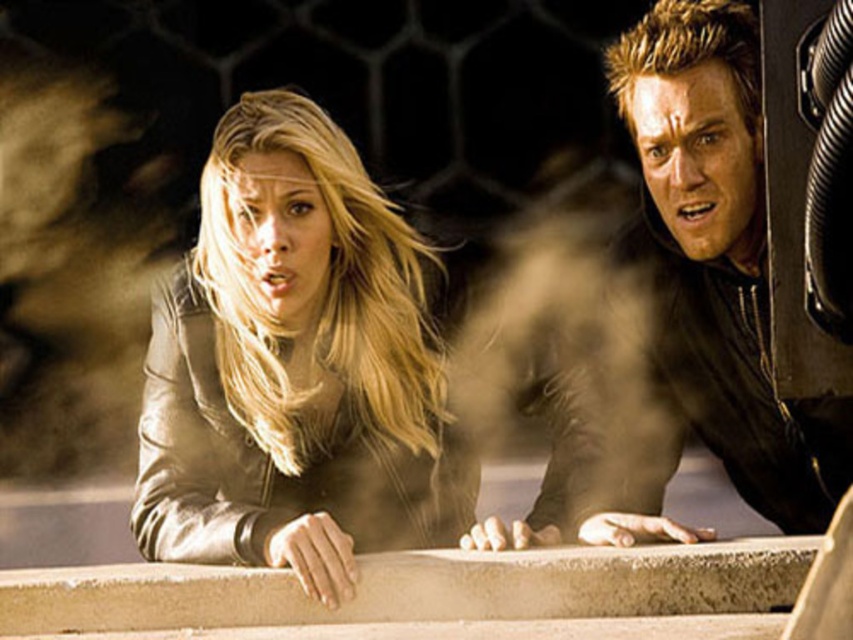
Question: Does leather jacket at center appear on the right side of matte black jacket at right?

Choices:
 (A) yes
 (B) no

Answer: (B)

Question: Is leather jacket at center below matte black jacket at right?

Choices:
 (A) no
 (B) yes

Answer: (B)

Question: Is leather jacket at center above matte black jacket at right?

Choices:
 (A) no
 (B) yes

Answer: (A)

Question: Which of the following is the farthest from the observer?

Choices:
 (A) click(x=636, y=104)
 (B) click(x=193, y=310)

Answer: (B)

Question: Among these objects, which one is farthest from the camera?

Choices:
 (A) leather jacket at center
 (B) matte black jacket at right

Answer: (B)

Question: Which of the following is the farthest from the observer?

Choices:
 (A) (624, 51)
 (B) (404, 509)

Answer: (B)